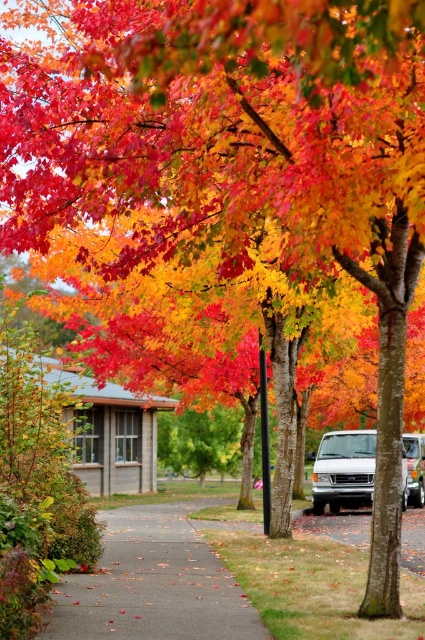
Is gray concrete sidewalk at center further to the viewer compared to white matte van at center?

No, gray concrete sidewalk at center is in front of white matte van at center.

Between gray concrete sidewalk at center and white matte van at center, which one is positioned higher?

Positioned higher is gray concrete sidewalk at center.

This screenshot has width=425, height=640. What are the coordinates of `gray concrete sidewalk at center` in the screenshot? It's located at (153, 582).